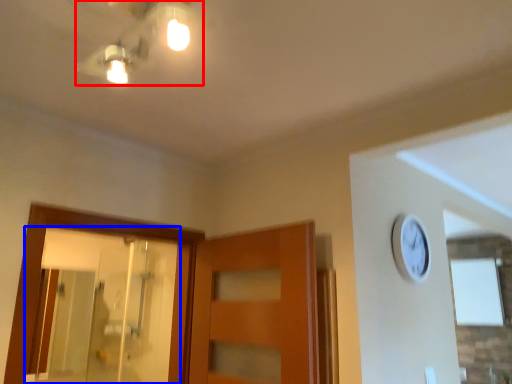
Question: Which object appears farthest to the camera in this image, light fixture (highlighted by a red box) or mirror (highlighted by a blue box)?

Choices:
 (A) light fixture
 (B) mirror

Answer: (B)